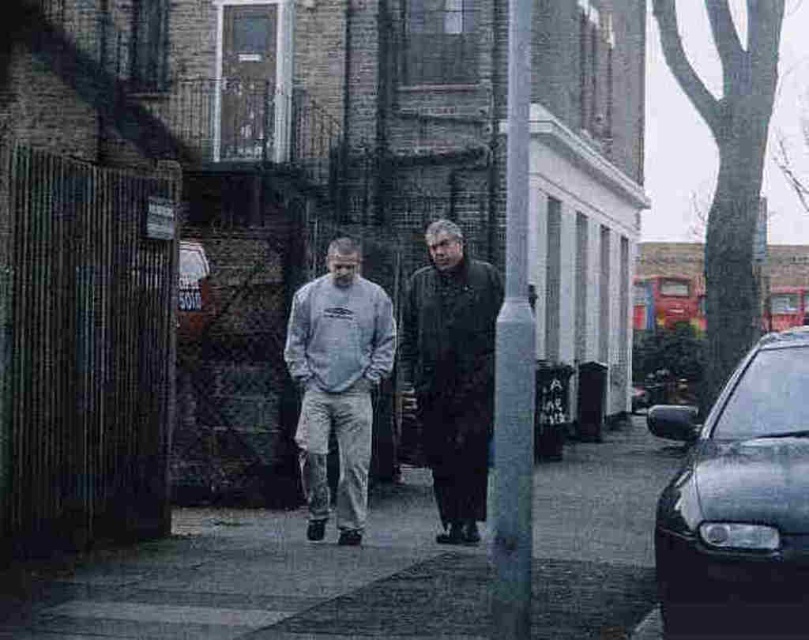
Question: Is shiny black car at right further to camera compared to gray cotton sweatshirt at center?

Choices:
 (A) yes
 (B) no

Answer: (B)

Question: Which point is farther to the camera?

Choices:
 (A) (782, 388)
 (B) (191, 541)

Answer: (B)

Question: From the image, what is the correct spatial relationship of shiny black car at right in relation to dark brown leather coat at center?

Choices:
 (A) above
 (B) below

Answer: (B)

Question: Which point is closer to the camera taking this photo?

Choices:
 (A) (403, 342)
 (B) (198, 516)

Answer: (A)

Question: Which object is the closest to the shiny black car at right?

Choices:
 (A) gray concrete pavement at center
 (B) gray cotton sweatshirt at center
 (C) dark brown leather coat at center

Answer: (C)

Question: Does shiny black car at right lie behind dark brown leather coat at center?

Choices:
 (A) no
 (B) yes

Answer: (A)